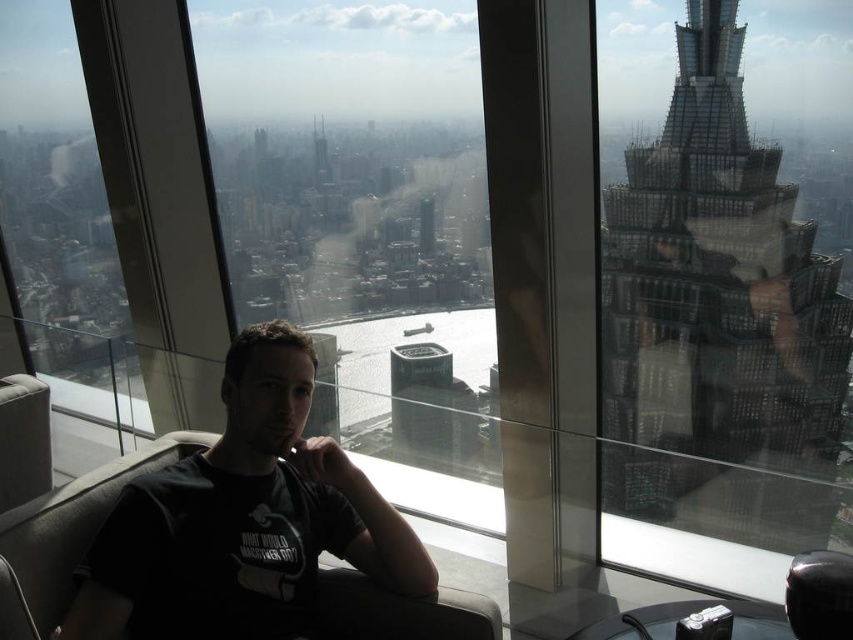
You are an architect planning to install a large decorative banner between the transparent glass window at right and the transparent glass window at center. Given that the banner requires a distance of at least 600 feet between the two windows to be safely displayed, will the current spacing between them allow this installation?

The transparent glass window at right is 635.87 feet from the transparent glass window at center, which exceeds the minimum required distance of 600 feet. Therefore, the banner can be safely displayed between them.

You are a delivery person trying to deliver a package to the person sitting on the sofa. You can only see the transparent glass window at center and the black matte shirt at center from outside. Which object should you look for first to locate the correct apartment?

The transparent glass window at center is positioned on the right side of the black matte shirt at center, so you should look for the black matte shirt at center first since it is on the left side and closer to your line of sight from outside.

You are a window cleaner and need to clean both the transparent glass window at right and the transparent glass window at center. Which window should you clean first if you want to start from the lower one?

The transparent glass window at right is below the transparent glass window at center, so you should clean the transparent glass window at right first.